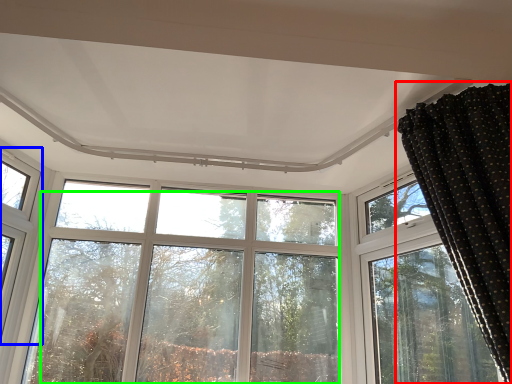
Question: Which object is positioned closest to curtain (highlighted by a red box)? Select from window (highlighted by a blue box) and tree (highlighted by a green box).

Choices:
 (A) window
 (B) tree

Answer: (B)